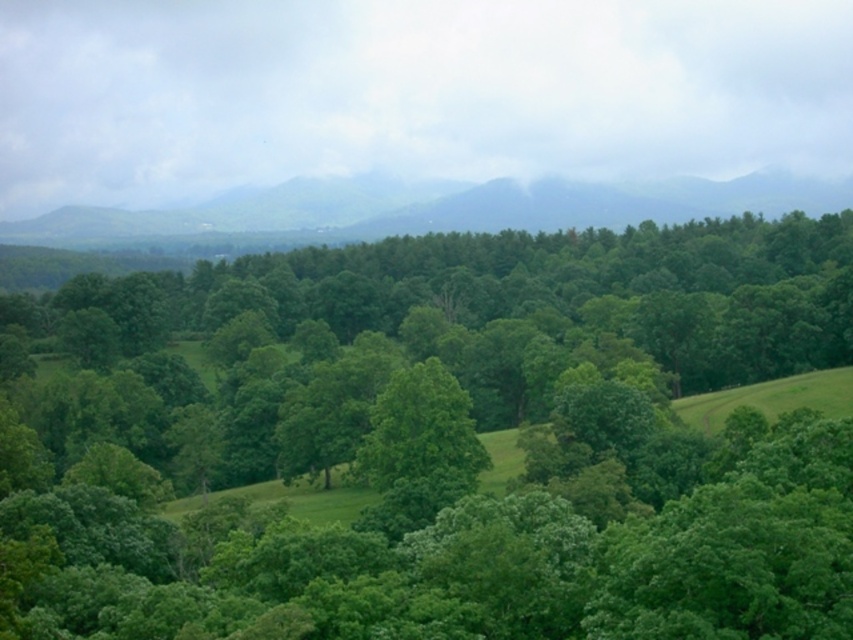
Between green leafy forest at center and green matte mountain at upper center, which one has more height?

green leafy forest at center

Between point (735, 625) and point (485, 212), which one is positioned behind?

Positioned behind is point (485, 212).

I want to click on green leafy forest at center, so click(438, 442).